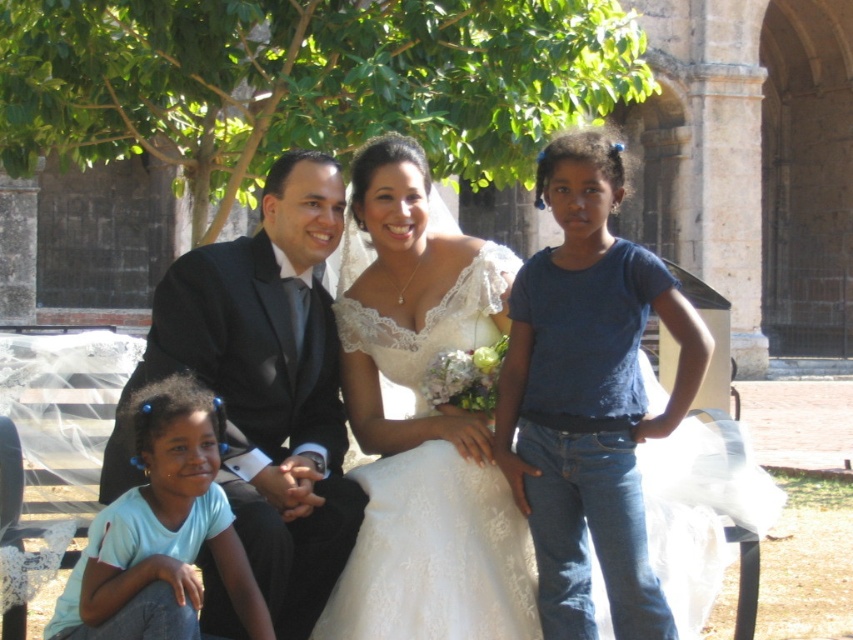
Is point (599, 189) positioned after point (161, 278)?

No, it is not.

Can you confirm if matte black suit at center is wider than shiny black suit at center?

Yes.

What do you see at coordinates (503, 417) in the screenshot? The height and width of the screenshot is (640, 853). I see `matte black suit at center` at bounding box center [503, 417].

Locate an element on the screen. This screenshot has width=853, height=640. matte black suit at center is located at coordinates (503, 417).

The width and height of the screenshot is (853, 640). What do you see at coordinates (589, 396) in the screenshot?
I see `blue denim jeans at center` at bounding box center [589, 396].

Does blue denim jeans at center appear on the right side of light blue t-shirt at lower left?

Yes, blue denim jeans at center is to the right of light blue t-shirt at lower left.

This screenshot has height=640, width=853. Find the location of `blue denim jeans at center`. blue denim jeans at center is located at coordinates (589, 396).

Can you confirm if matte black suit at center is taller than blue denim jeans at center?

Yes, matte black suit at center is taller than blue denim jeans at center.

Does matte black suit at center have a smaller size compared to blue denim jeans at center?

Actually, matte black suit at center might be larger than blue denim jeans at center.

Does point (364, 147) come farther from viewer compared to point (572, 387)?

That is True.

Where is `matte black suit at center`? Image resolution: width=853 pixels, height=640 pixels. matte black suit at center is located at coordinates (503, 417).